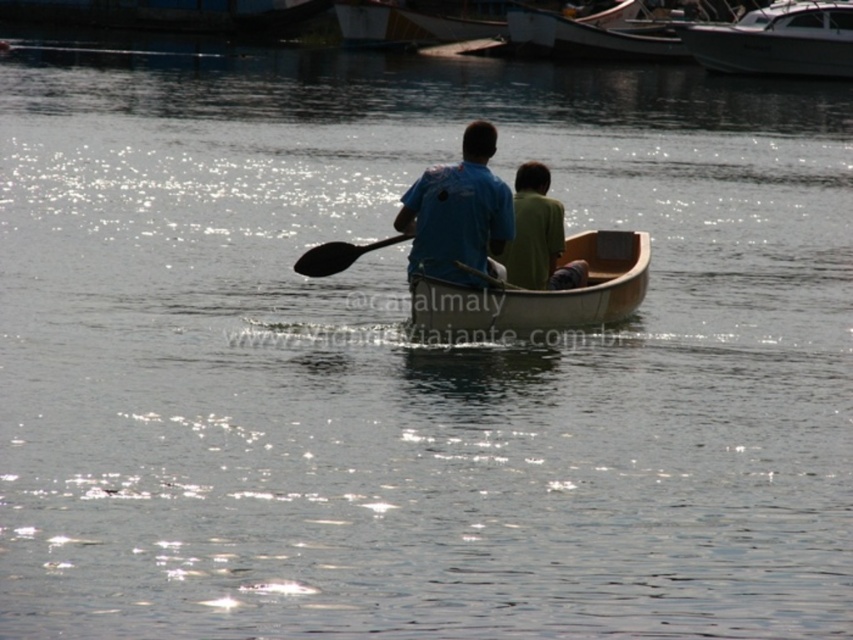
Question: Estimate the real-world distances between objects in this image. Which object is closer to the green matte shirt at center?

Choices:
 (A) wooden boat at center
 (B) matte blue shirt at center
 (C) black wood paddle at center
 (D) white glossy boat at upper right

Answer: (B)

Question: Which object is closer to the camera taking this photo?

Choices:
 (A) wooden canoe at center
 (B) white glossy boat at upper right
 (C) wooden boat at center
 (D) matte blue shirt at center

Answer: (D)

Question: From the image, what is the correct spatial relationship of wooden boat at center in relation to green matte shirt at center?

Choices:
 (A) right
 (B) left

Answer: (A)

Question: Does wooden canoe at center come behind white glossy boat at upper right?

Choices:
 (A) no
 (B) yes

Answer: (A)

Question: Does matte blue shirt at center appear on the right side of green matte shirt at center?

Choices:
 (A) yes
 (B) no

Answer: (B)

Question: Which point appears closest to the camera in this image?

Choices:
 (A) (532, 179)
 (B) (451, 204)

Answer: (B)